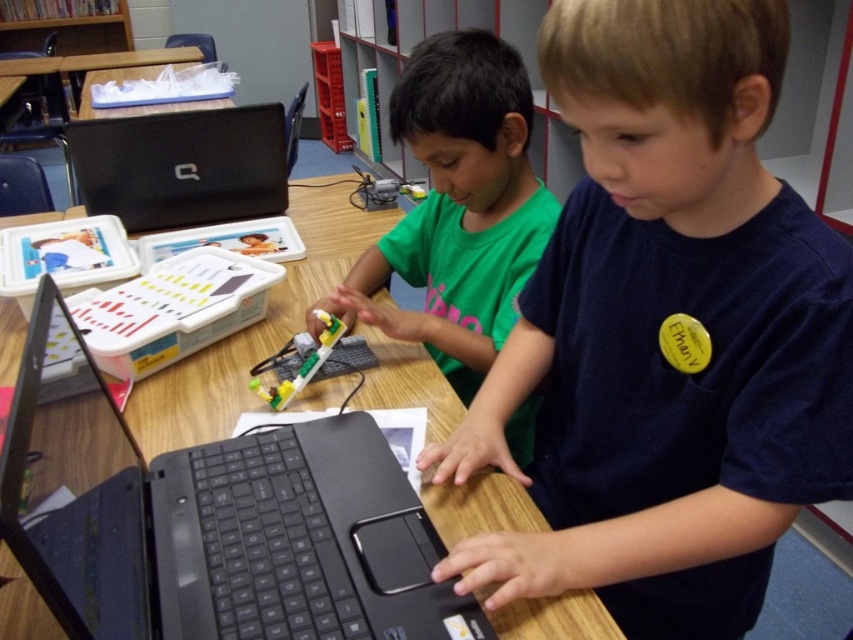
Question: Which object is the farthest from the dark blue shirt at center?

Choices:
 (A) black matte laptop at upper left
 (B) black matte laptop at center

Answer: (A)

Question: Which point is farther from the camera taking this photo?

Choices:
 (A) (456, 365)
 (B) (141, 198)
 (C) (244, 461)
 (D) (624, 429)

Answer: (B)

Question: Which is farther from the green matte shirt at center?

Choices:
 (A) black matte laptop at center
 (B) black matte laptop at upper left

Answer: (B)

Question: Is dark blue shirt at center closer to camera compared to green matte shirt at center?

Choices:
 (A) no
 (B) yes

Answer: (B)

Question: Does dark blue shirt at center appear on the right side of black matte laptop at upper left?

Choices:
 (A) no
 (B) yes

Answer: (B)

Question: Does black matte laptop at center lie in front of green matte shirt at center?

Choices:
 (A) no
 (B) yes

Answer: (B)